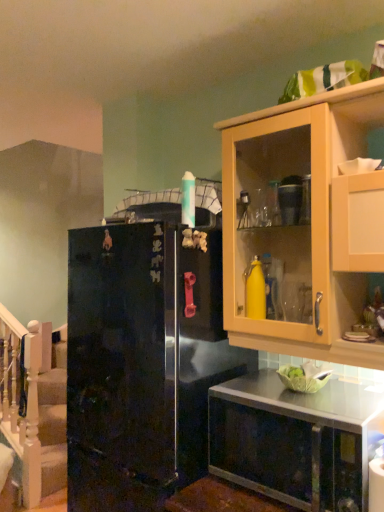
Question: Is white wooden staircase at left a part of glossy black refrigerator at left?

Choices:
 (A) yes
 (B) no

Answer: (B)

Question: Does glossy black refrigerator at left have a greater width compared to white wooden staircase at left?

Choices:
 (A) no
 (B) yes

Answer: (B)

Question: Is the position of glossy black refrigerator at left more distant than that of white wooden staircase at left?

Choices:
 (A) yes
 (B) no

Answer: (B)

Question: Can you confirm if glossy black refrigerator at left is bigger than white wooden staircase at left?

Choices:
 (A) no
 (B) yes

Answer: (B)

Question: Is glossy black refrigerator at left at the left side of white wooden staircase at left?

Choices:
 (A) no
 (B) yes

Answer: (A)

Question: Is glossy black refrigerator at left smaller than white wooden staircase at left?

Choices:
 (A) no
 (B) yes

Answer: (A)

Question: Does light wood cabinet at upper right have a lesser width compared to metallic stainless steel microwave at lower right?

Choices:
 (A) yes
 (B) no

Answer: (A)

Question: Is light wood cabinet at upper right shorter than metallic stainless steel microwave at lower right?

Choices:
 (A) yes
 (B) no

Answer: (B)

Question: Does light wood cabinet at upper right turn towards metallic stainless steel microwave at lower right?

Choices:
 (A) no
 (B) yes

Answer: (A)

Question: Can you see light wood cabinet at upper right touching metallic stainless steel microwave at lower right?

Choices:
 (A) no
 (B) yes

Answer: (A)

Question: Is light wood cabinet at upper right turned away from metallic stainless steel microwave at lower right?

Choices:
 (A) yes
 (B) no

Answer: (B)

Question: Is metallic stainless steel microwave at lower right completely or partially inside light wood cabinet at upper right?

Choices:
 (A) yes
 (B) no

Answer: (B)

Question: Is light wood cabinet at upper right turned away from glossy black refrigerator at left?

Choices:
 (A) yes
 (B) no

Answer: (B)